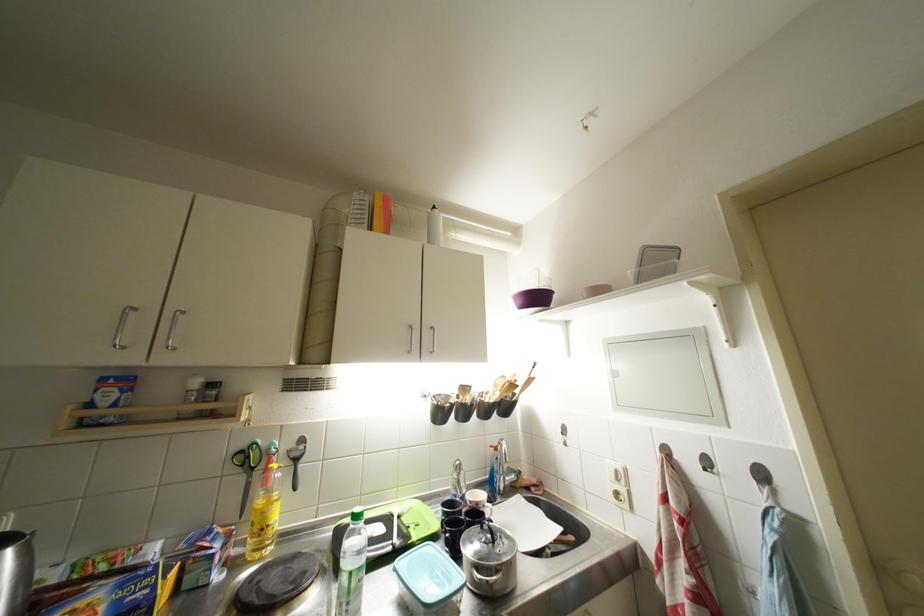
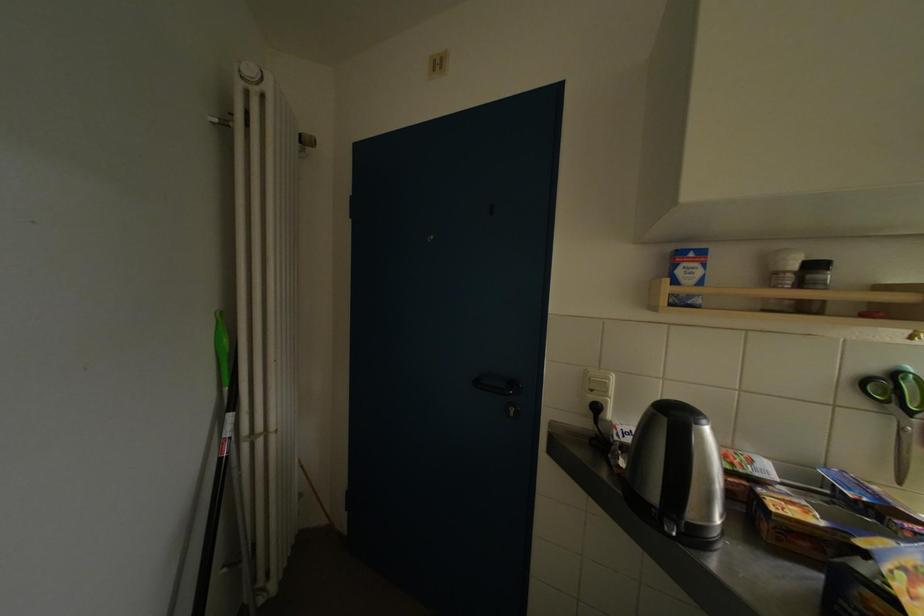
Where in the second image is the point corresponding to (x=104, y=400) from the first image?

(686, 276)